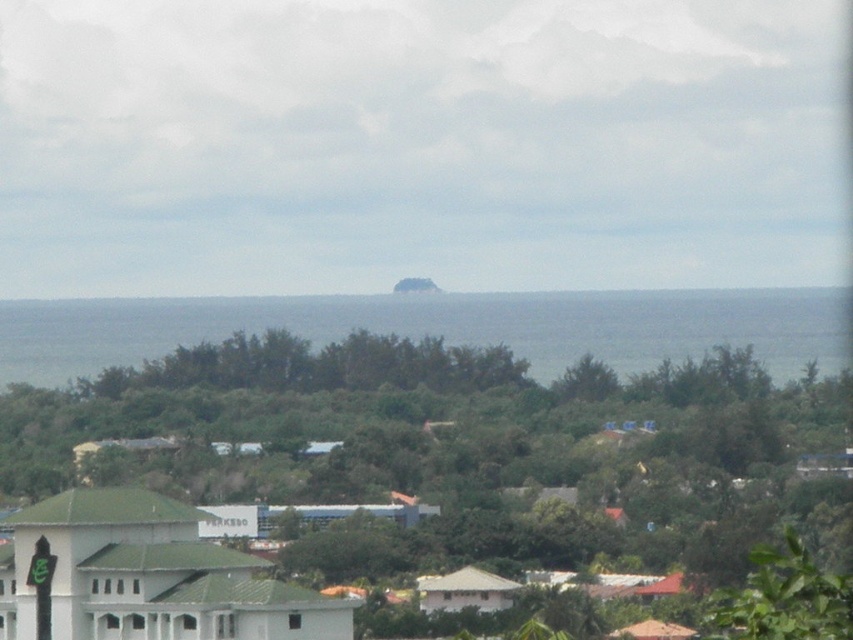
You are standing at the parking building and want to reach the ocean. Which direction should you walk to avoid the green leafy tree at center located at point (450,451)?

To avoid the green leafy tree at center located at point (450,451), you should walk towards the left or right since the tree is directly in the center path between the parking building and the ocean.